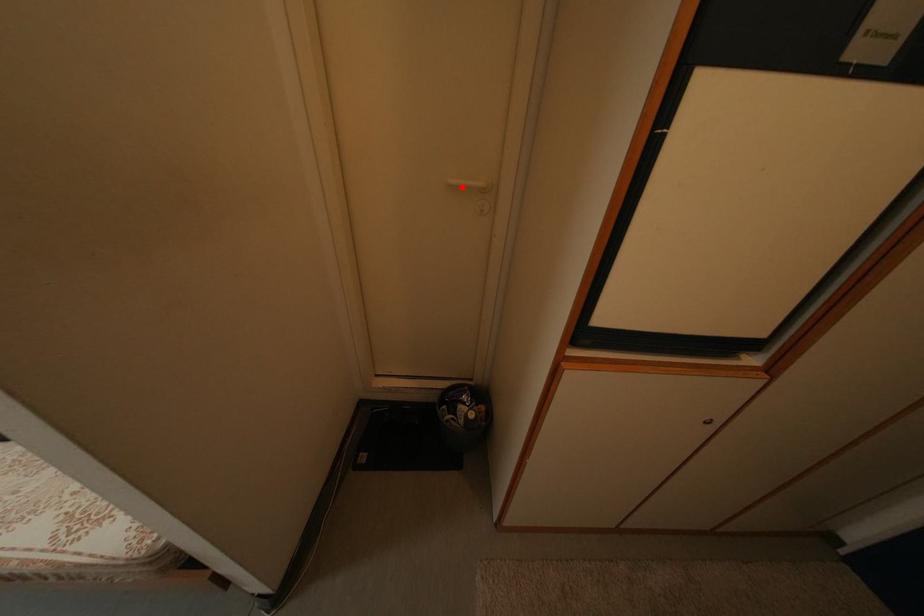
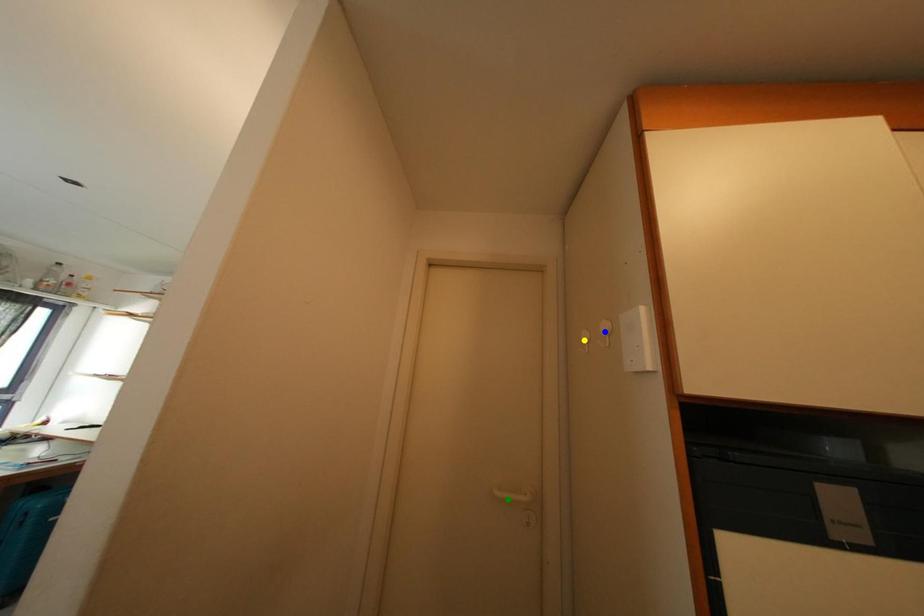
Question: I am providing you with two images of the same scene from different viewpoints. A red point is marked on the first image. You are given multiple points on the second image. In image 2, which mark is for the same physical point as the one in image 1?

Choices:
 (A) blue point
 (B) yellow point
 (C) green point

Answer: (C)